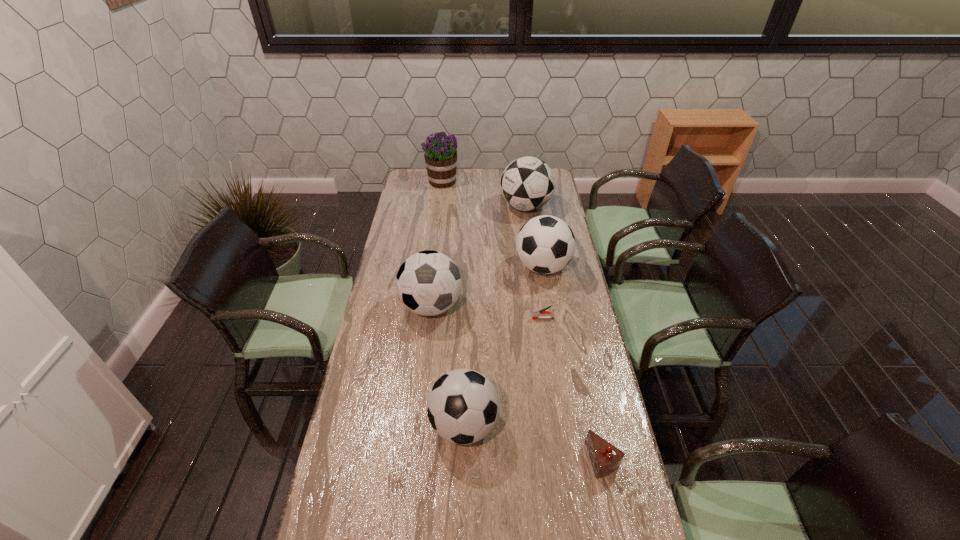
This screenshot has width=960, height=540. I want to click on vacant space that satisfies the following two spatial constraints: 1. on the handle side of the chocolate cake; 2. on the right side of the stapler, so point(564,459).

Locate an element on the screen. This screenshot has width=960, height=540. vacant region that satisfies the following two spatial constraints: 1. on the handle side of the stapler; 2. on the left side of the chocolate cake is located at coordinates (564, 459).

Locate an element on the screen. The image size is (960, 540). free space in the image that satisfies the following two spatial constraints: 1. on the front side of the chocolate cake; 2. on the left side of the shortest soccer ball is located at coordinates (463, 459).